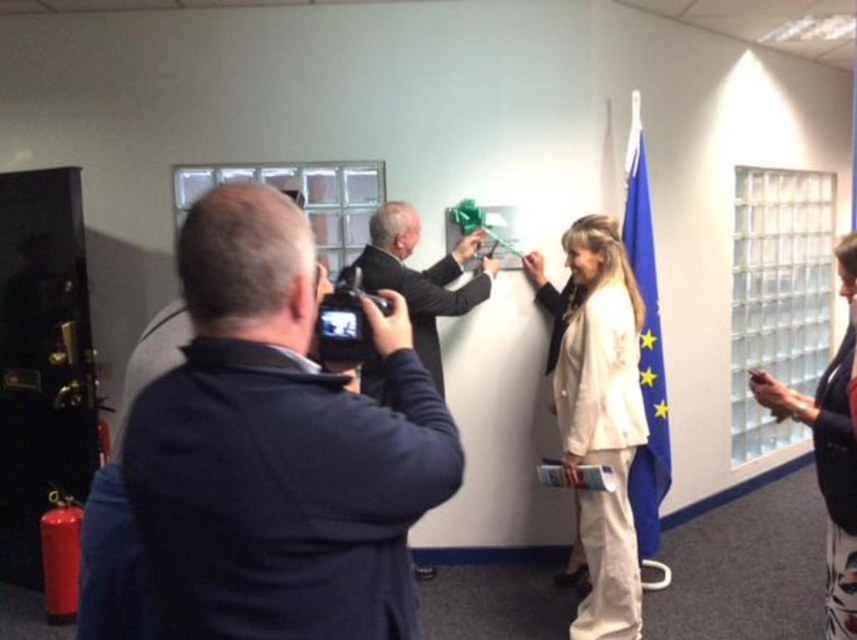
Describe the element at coordinates (829, 451) in the screenshot. This screenshot has height=640, width=857. I see `floral pants at right` at that location.

Consider the image. Can you confirm if floral pants at right is shorter than blue fabric flag at right?

Yes.

What are the coordinates of `floral pants at right` in the screenshot? It's located at (829, 451).

Which is more to the left, light beige fabric jacket at center or floral pants at right?

light beige fabric jacket at center is more to the left.

Is light beige fabric jacket at center bigger than floral pants at right?

Yes, light beige fabric jacket at center is bigger than floral pants at right.

Between point (562, 337) and point (838, 477), which one is positioned in front?

Positioned in front is point (838, 477).

Locate an element on the screen. The width and height of the screenshot is (857, 640). light beige fabric jacket at center is located at coordinates (602, 420).

Can you confirm if light beige fabric jacket at center is bigger than blue fabric flag at right?

Yes, light beige fabric jacket at center is bigger than blue fabric flag at right.

Who is more forward, (573, 336) or (640, 179)?

Point (573, 336)

Locate an element on the screen. The image size is (857, 640). light beige fabric jacket at center is located at coordinates (602, 420).